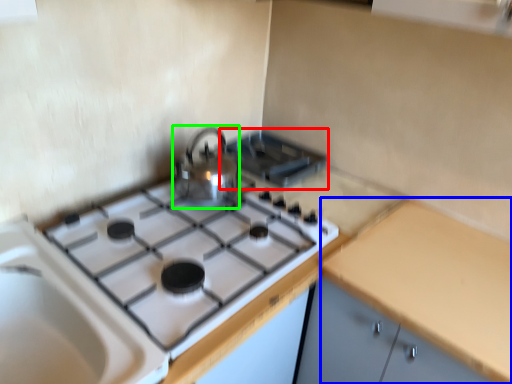
Question: Which object is the closest to the appliance (highlighted by a red box)? Choose among these: counter top (highlighted by a blue box) or kitchen appliance (highlighted by a green box).

Choices:
 (A) counter top
 (B) kitchen appliance

Answer: (B)